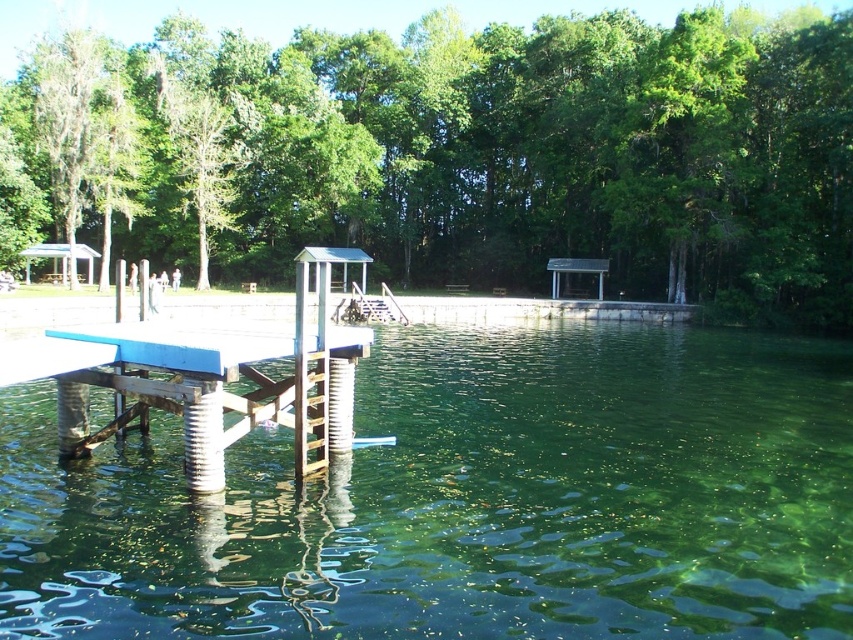
You are standing on the wooden dock and looking towards the center of the lake. There is a point marked at coordinates point [467,499]. What is located at that point?

The point [467,499] indicates green translucent water at center.

You are planning to set up a picnic at the lakeside. You want to choose a spot where the green leafy tree at center can provide shade and the blue painted wood picnic table at center is nearby. Which object should you position closer to for the best shade and accessibility?

The green leafy tree at center is bigger than the blue painted wood picnic table at center, so positioning closer to the green leafy tree at center will provide better shade while the picnic table is nearby for accessibility.